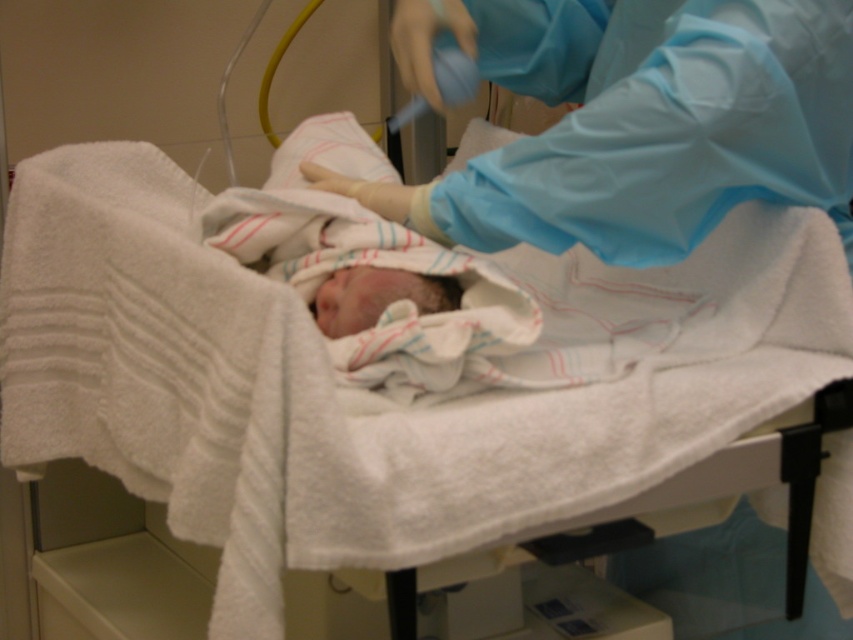
Question: Considering the relative positions of blue smooth gown at upper right and soft white swaddle at center in the image provided, where is blue smooth gown at upper right located with respect to soft white swaddle at center?

Choices:
 (A) above
 (B) below

Answer: (A)

Question: Does blue smooth gown at upper right lie in front of soft white swaddle at center?

Choices:
 (A) no
 (B) yes

Answer: (B)

Question: Which object appears farthest from the camera in this image?

Choices:
 (A) blue smooth gown at upper right
 (B) soft white swaddle at center

Answer: (B)

Question: In this image, where is blue smooth gown at upper right located relative to soft white swaddle at center?

Choices:
 (A) above
 (B) below

Answer: (A)

Question: Which point appears farthest from the camera in this image?

Choices:
 (A) (718, 152)
 (B) (444, 292)

Answer: (B)

Question: Which point is farther to the camera?

Choices:
 (A) (796, 35)
 (B) (349, 275)

Answer: (B)